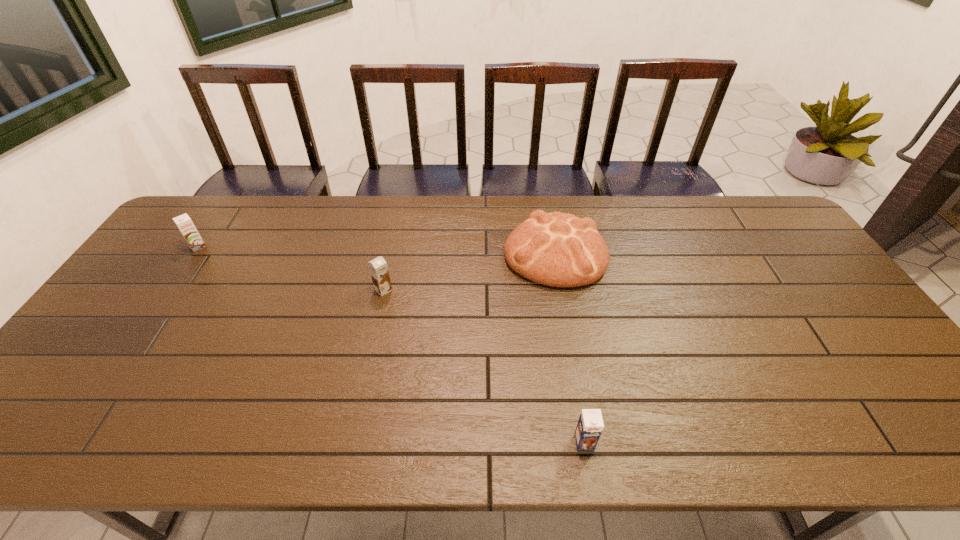
At what (x,y) coordinates should I click in order to perform the action: click on object that is at the far edge. Please return your answer as a coordinate pair (x, y). Looking at the image, I should click on (555, 249).

I want to click on object positioned at the near edge, so click(x=590, y=425).

The height and width of the screenshot is (540, 960). In order to click on object present at the left edge in this screenshot , I will do `click(184, 223)`.

In the image, there is a desktop. Identify the location of free region at the far edge. (295, 211).

You are a GUI agent. You are given a task and a screenshot of the screen. Output one action in this format:
    pyautogui.click(x=<x>, y=<y>)
    Task: Click on the vacant space at the near edge
    Image resolution: width=960 pixels, height=540 pixels.
    Given the screenshot: What is the action you would take?
    pyautogui.click(x=742, y=414)

This screenshot has width=960, height=540. Identify the location of vacant area at the right edge. (820, 323).

Image resolution: width=960 pixels, height=540 pixels. I want to click on free space between the bread and the second object from left to right, so click(x=469, y=272).

This screenshot has width=960, height=540. Find the location of `free space that is in between the second nearest chocolate milk and the leftmost object`. free space that is in between the second nearest chocolate milk and the leftmost object is located at coordinates (291, 268).

Locate an element on the screen. empty location between the nearest object and the farthest chocolate milk is located at coordinates (391, 345).

The height and width of the screenshot is (540, 960). I want to click on vacant space that's between the farthest chocolate milk and the second chocolate milk from left to right, so click(x=291, y=268).